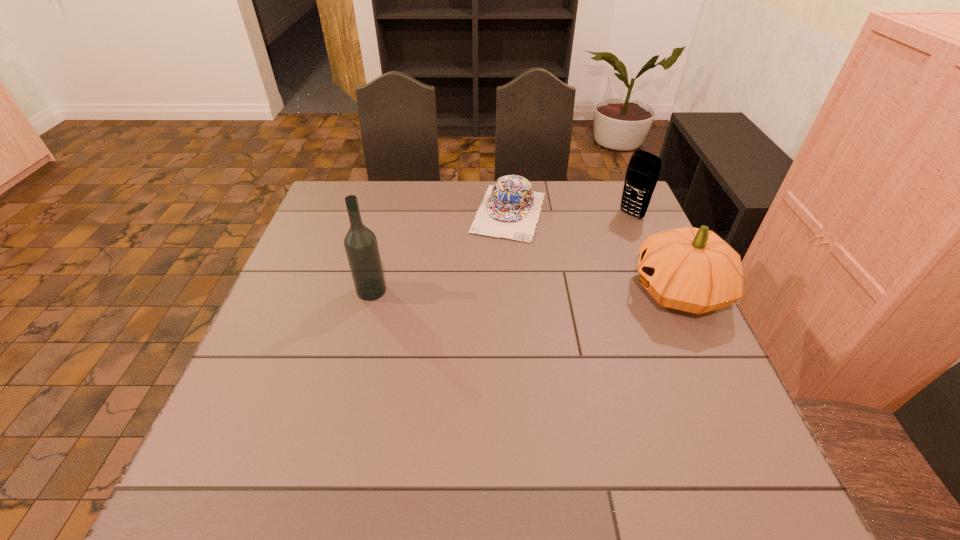
The height and width of the screenshot is (540, 960). I want to click on vodka, so click(360, 243).

This screenshot has height=540, width=960. Find the location of `the tallest object`. the tallest object is located at coordinates (360, 243).

You are a GUI agent. You are given a task and a screenshot of the screen. Output one action in this format:
    pyautogui.click(x=<x>, y=<y>)
    Task: Click on the gourd
    The height and width of the screenshot is (540, 960).
    Given the screenshot: What is the action you would take?
    pyautogui.click(x=691, y=269)

Locate an element on the screen. cellular telephone is located at coordinates (642, 174).

Image resolution: width=960 pixels, height=540 pixels. Identify the location of the shortest object. (511, 208).

You are a GUI agent. You are given a task and a screenshot of the screen. Output one action in this format:
    pyautogui.click(x=<x>, y=<y>)
    Task: Click on the second object from left to right
    
    Given the screenshot: What is the action you would take?
    [511, 208]

The height and width of the screenshot is (540, 960). Find the location of `blank space located 0.230m on the front of the tallest object`. blank space located 0.230m on the front of the tallest object is located at coordinates (348, 381).

Identify the location of vacant space situated 0.090m on the side of the gourd with the carved face. The image size is (960, 540). (594, 292).

Image resolution: width=960 pixels, height=540 pixels. I want to click on free space located 0.400m on the side of the gourd with the carved face, so click(472, 292).

This screenshot has width=960, height=540. I want to click on free location located on the side of the gourd with the carved face, so click(527, 292).